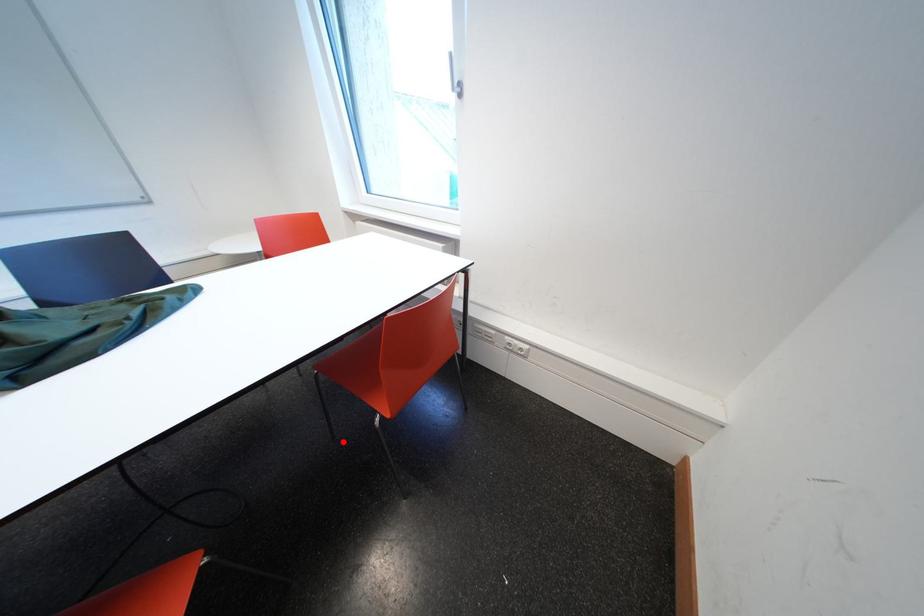
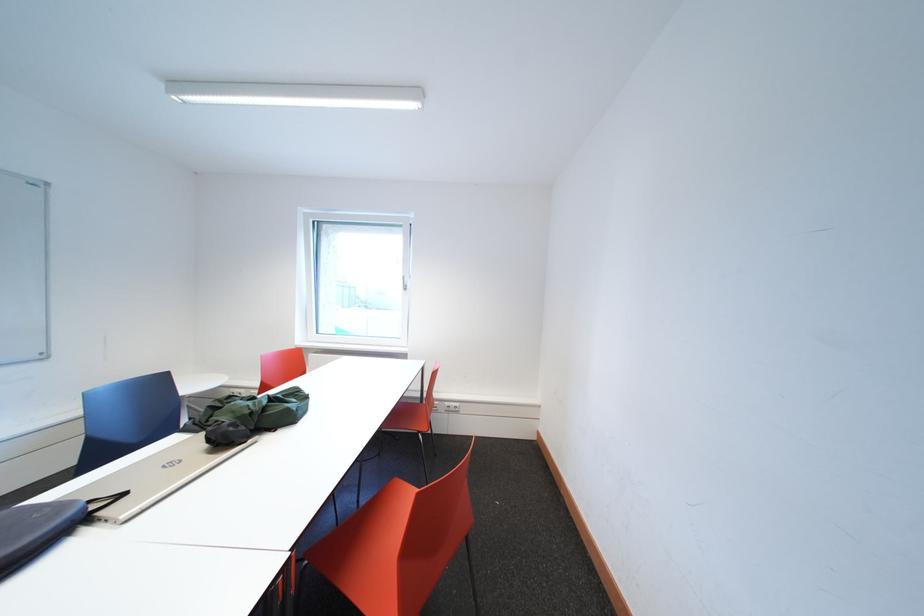
Where in the second image is the point corresponding to the highlighted location from the first image?

(368, 506)